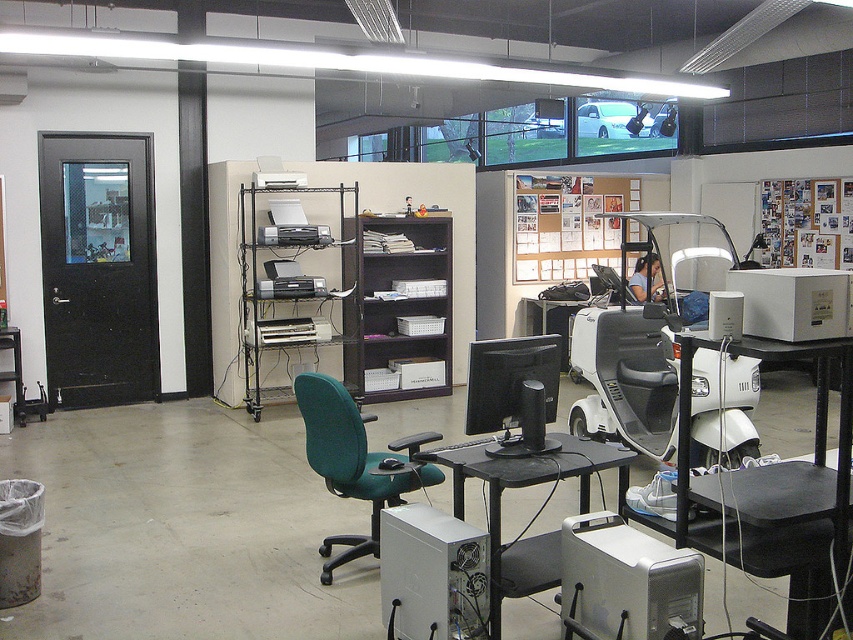
Based on the photo, you are an office worker who needs to adjust the height of your computer monitor. You are currently sitting in the teal fabric swivel chair at center. Can you comfortably reach the white plastic desktop computer at center to adjust its height?

The white plastic desktop computer at center is shorter than the teal fabric swivel chair at center, so you may need to lean forward or adjust your posture to reach it comfortably.